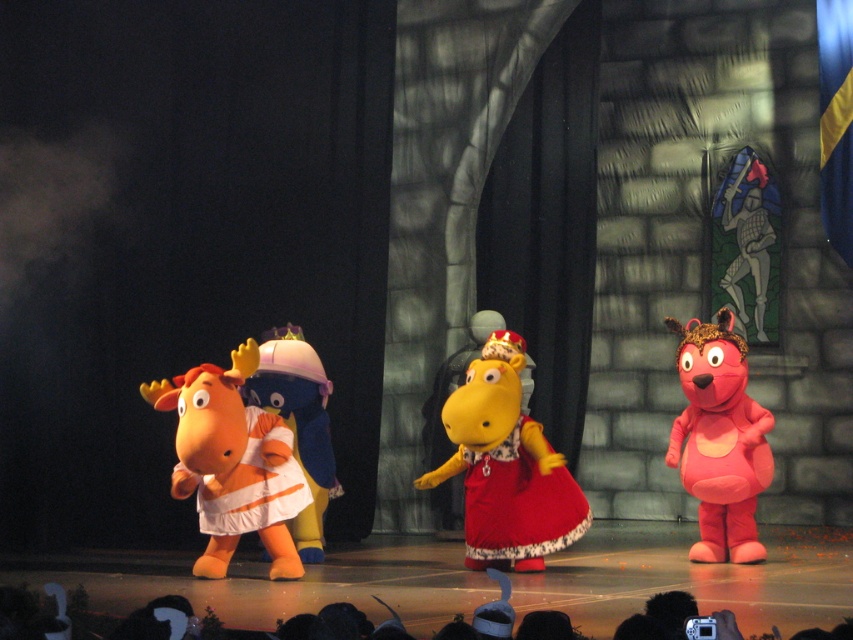
Which is more to the right, white fabric duckling at center or orange fabric dress at center?

From the viewer's perspective, white fabric duckling at center appears more on the right side.

Can you confirm if white fabric duckling at center is positioned to the left of orange fabric dress at center?

No, white fabric duckling at center is not to the left of orange fabric dress at center.

Is point (271, 397) farther from camera compared to point (283, 481)?

That is True.

At what (x,y) coordinates should I click in order to perform the action: click on white fabric duckling at center. Please return your answer as a coordinate pair (x, y). Looking at the image, I should click on (299, 422).

Which is below, yellow plush hippo at center or matte red dress at center?

matte red dress at center is below.

Which is behind, point (554, 480) or point (502, 488)?

The point (554, 480) is more distant.

The height and width of the screenshot is (640, 853). What are the coordinates of `yellow plush hippo at center` in the screenshot? It's located at (506, 467).

Does pink plush dog at right appear under matte red dress at center?

No, pink plush dog at right is not below matte red dress at center.

Who is shorter, pink plush dog at right or matte red dress at center?

matte red dress at center

What do you see at coordinates (718, 440) in the screenshot? The image size is (853, 640). I see `pink plush dog at right` at bounding box center [718, 440].

You are a GUI agent. You are given a task and a screenshot of the screen. Output one action in this format:
    pyautogui.click(x=<x>, y=<y>)
    Task: Click on the pink plush dog at right
    The width and height of the screenshot is (853, 640).
    Given the screenshot: What is the action you would take?
    pyautogui.click(x=718, y=440)